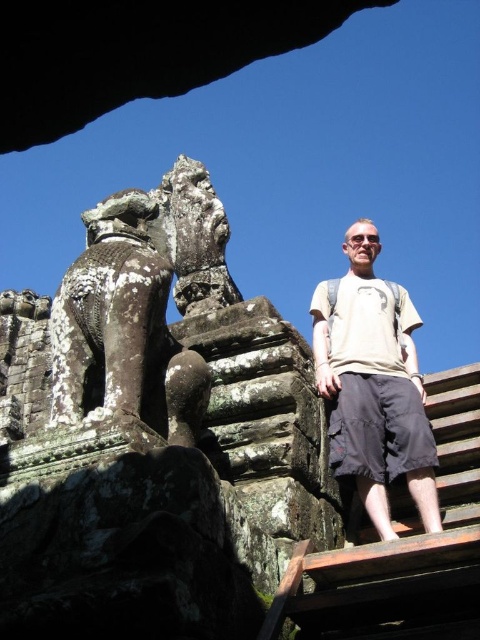
Question: Which point is closer to the camera?

Choices:
 (A) weathered stone statue at upper center
 (B) beige cotton t-shirt at center

Answer: (B)

Question: Considering the relative positions of wooden stairs at center and beige cotton t-shirt at center in the image provided, where is wooden stairs at center located with respect to beige cotton t-shirt at center?

Choices:
 (A) right
 (B) left

Answer: (A)

Question: Which of the following is the closest to the observer?

Choices:
 (A) beige cotton t-shirt at center
 (B) wooden stairs at center

Answer: (B)

Question: Can you confirm if wooden stairs at center is thinner than weathered stone statue at upper center?

Choices:
 (A) yes
 (B) no

Answer: (B)

Question: Is wooden stairs at center positioned in front of weathered stone statue at upper center?

Choices:
 (A) no
 (B) yes

Answer: (B)

Question: Which object appears farthest from the camera in this image?

Choices:
 (A) wooden stairs at center
 (B) weathered stone statue at upper center
 (C) beige cotton t-shirt at center

Answer: (B)